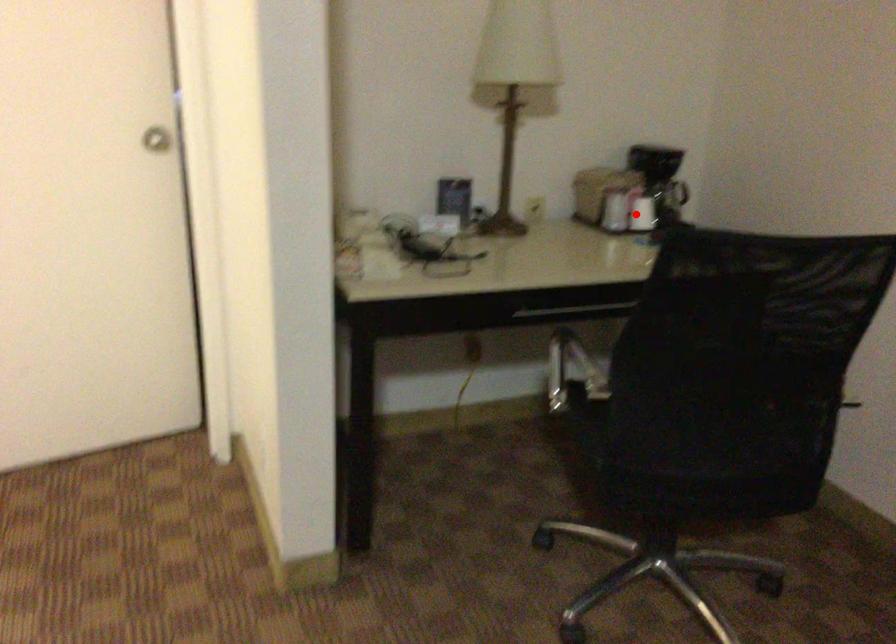
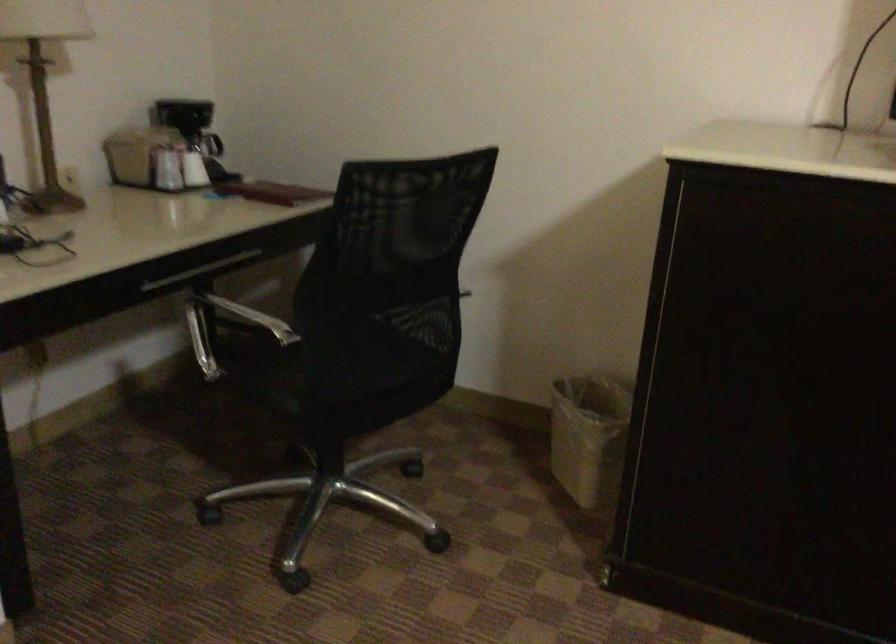
Locate, in the second image, the point that corresponds to the highlighted location in the first image.

(194, 169)